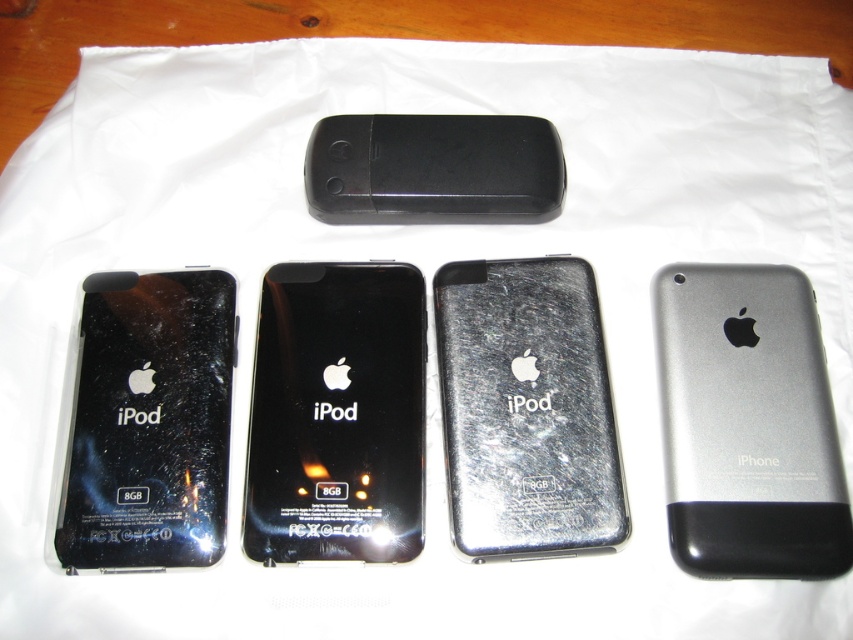
You are organizing these iPods on a shelf. The black glossy ipod at left and the metallic silver ipod at center need to be placed side by side. Which one should you place closer to the front of the shelf to match their arrangement in the image?

The black glossy ipod at left should be placed closer to the front of the shelf because it is closer to the viewer than the metallic silver ipod at center in the image.